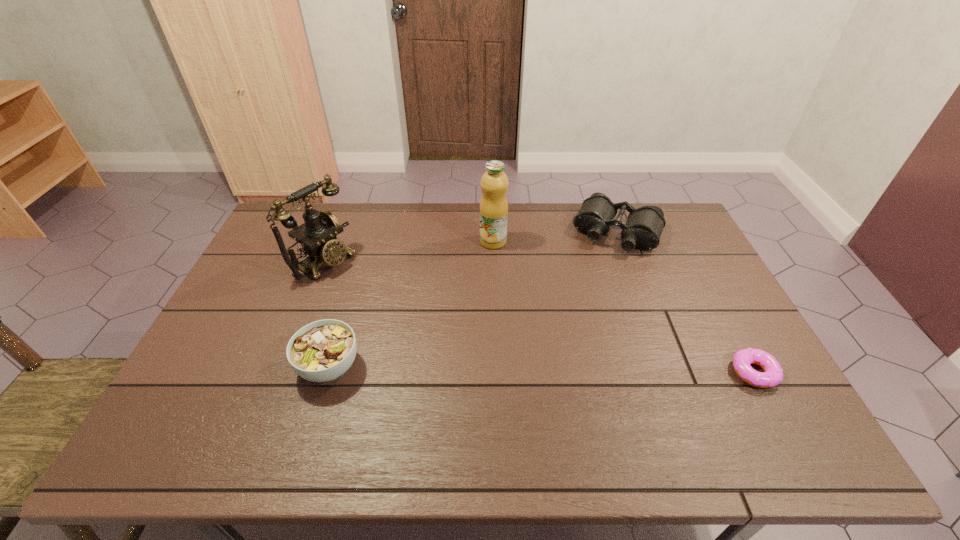
Find the location of a particular element. doughnut that is at the near edge is located at coordinates click(x=773, y=373).

At what (x,y) coordinates should I click in order to perform the action: click on object at the left edge. Please return your answer as a coordinate pair (x, y). The height and width of the screenshot is (540, 960). Looking at the image, I should click on tap(317, 236).

This screenshot has width=960, height=540. What are the coordinates of `doughnut that is at the right edge` in the screenshot? It's located at (773, 373).

Where is `binoculars that is at the right edge`? The width and height of the screenshot is (960, 540). binoculars that is at the right edge is located at coordinates (643, 229).

Image resolution: width=960 pixels, height=540 pixels. In order to click on object that is at the far left corner in this screenshot , I will do `click(317, 236)`.

At what (x,y) coordinates should I click in order to perform the action: click on object that is at the far right corner. Please return your answer as a coordinate pair (x, y). The width and height of the screenshot is (960, 540). Looking at the image, I should click on (643, 229).

This screenshot has width=960, height=540. I want to click on object located in the near right corner section of the desktop, so click(x=773, y=373).

You are a GUI agent. You are given a task and a screenshot of the screen. Output one action in this format:
    pyautogui.click(x=<x>, y=<y>)
    Task: Click on the vacant space at the far edge of the desktop
    The height and width of the screenshot is (540, 960).
    Given the screenshot: What is the action you would take?
    point(377,211)

Find the location of `blank area at the near edge`. blank area at the near edge is located at coordinates point(541,390).

You are a GUI agent. You are given a task and a screenshot of the screen. Output one action in this format:
    pyautogui.click(x=<x>, y=<y>)
    Task: Click on the vacant space at the left edge of the desktop
    This screenshot has height=540, width=960.
    Given the screenshot: What is the action you would take?
    pyautogui.click(x=247, y=356)